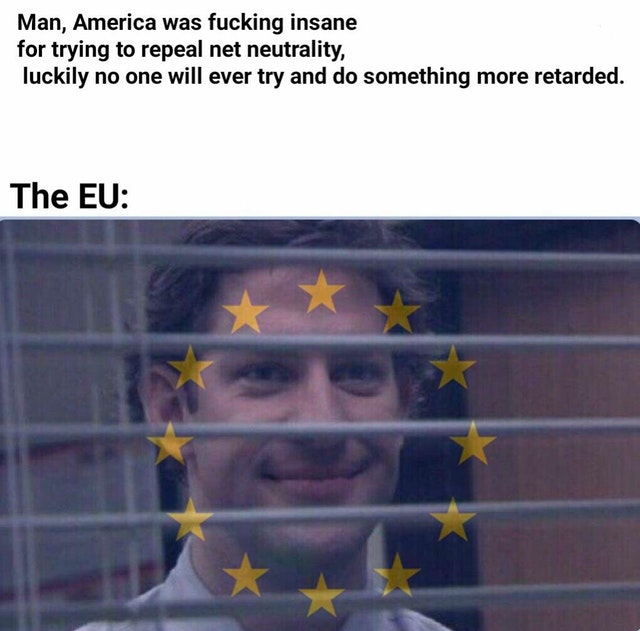
This screenshot has width=640, height=631. What are the coordinates of `window blinds` in the screenshot? It's located at (495, 428), (518, 505), (516, 587), (486, 341), (505, 262).